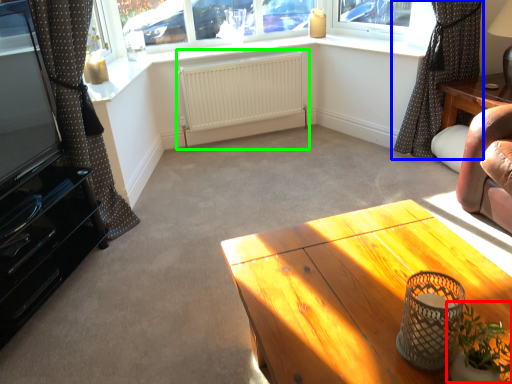
Question: Which object is the closest to the plant (highlighted by a red box)? Choose among these: curtain (highlighted by a blue box) or radiator (highlighted by a green box).

Choices:
 (A) curtain
 (B) radiator

Answer: (A)